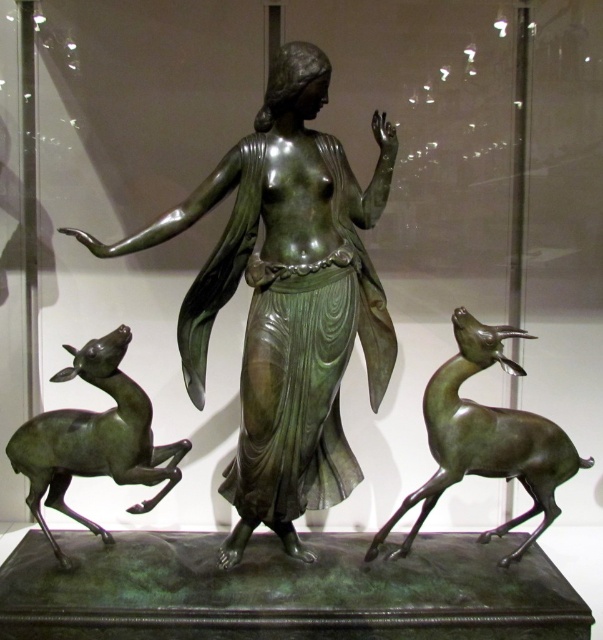
Question: Is green patina bronze statue at center above green patina deer at right?

Choices:
 (A) no
 (B) yes

Answer: (B)

Question: In this image, where is green patina bronze statue at center located relative to green patina deer at right?

Choices:
 (A) right
 (B) left

Answer: (B)

Question: Which point appears closest to the camera in this image?

Choices:
 (A) (563, 468)
 (B) (327, 198)
 (C) (81, 358)

Answer: (B)

Question: Among these points, which one is farthest from the camera?

Choices:
 (A) coord(305,387)
 (B) coord(385,528)

Answer: (B)

Question: Based on their relative distances, which object is farther from the green patina deer at right?

Choices:
 (A) green patina bronze statue at center
 (B) green patina deer at left

Answer: (B)

Question: Does green patina bronze statue at center lie in front of green patina deer at left?

Choices:
 (A) no
 (B) yes

Answer: (B)